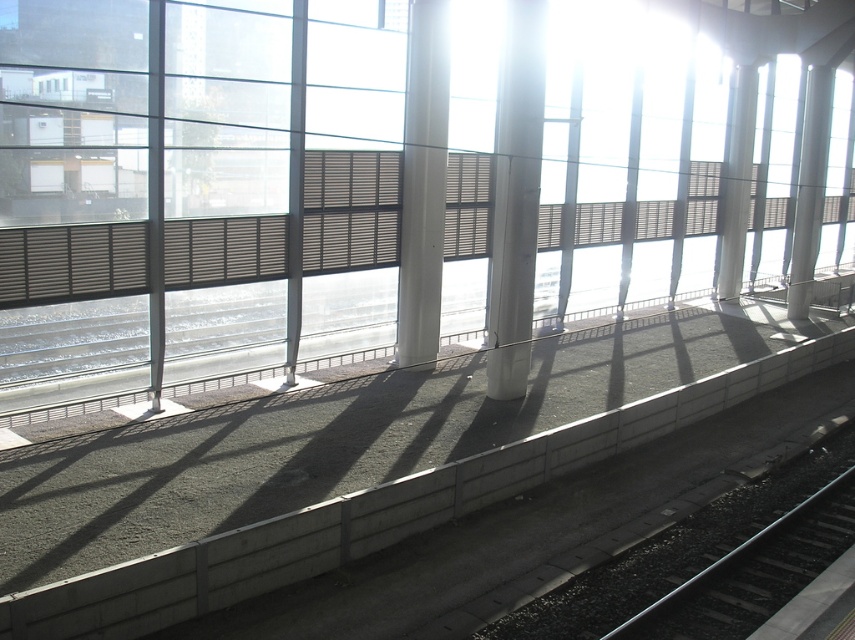
Is white smooth pillar at center closer to camera compared to white glossy pillar at upper right?

Yes, it is.

Who is positioned more to the left, white smooth pillar at center or white glossy pillar at upper right?

Positioned to the left is white smooth pillar at center.

Which is in front, point (422, 131) or point (728, 202)?

Point (422, 131) is in front.

Identify the location of white smooth pillar at center. This screenshot has height=640, width=855. (423, 182).

Is point (503, 243) more distant than point (750, 80)?

That is False.

Can you confirm if white glossy pillar at center is positioned to the left of white glossy pillar at upper right?

Indeed, white glossy pillar at center is positioned on the left side of white glossy pillar at upper right.

Identify the location of white glossy pillar at center. The image size is (855, 640). (516, 198).

Can you confirm if white glossy pillar at center is positioned to the left of white smooth pillar at center?

Incorrect, white glossy pillar at center is not on the left side of white smooth pillar at center.

Identify the location of white glossy pillar at center. (516, 198).

Identify the location of white glossy pillar at center. The height and width of the screenshot is (640, 855). (516, 198).